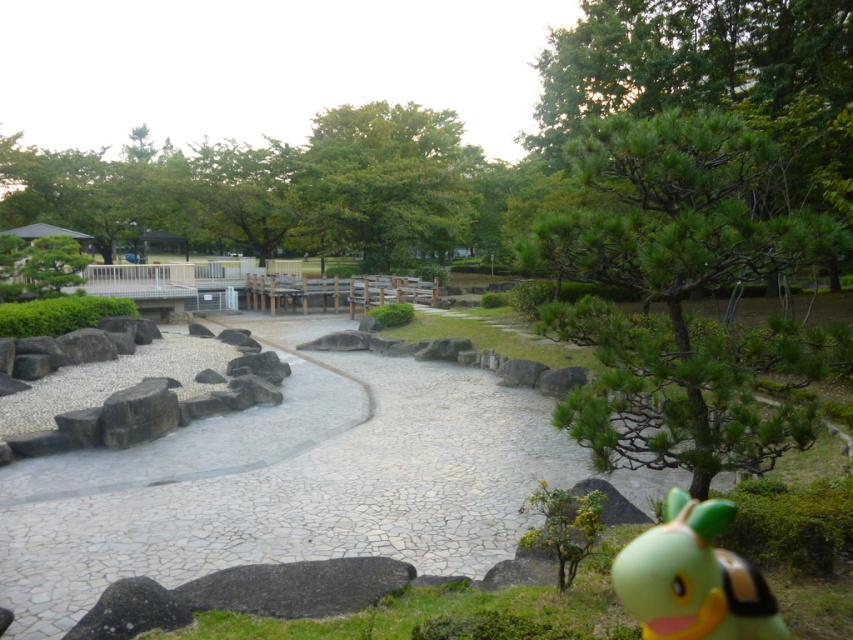
You are planning to walk along the white stone path at center and want to know if it is wide enough to pass by the green leafy tree at upper center without touching it. Can you determine this based on the scene?

The white stone path at center is smaller than the green leafy tree at upper center, so it might not be wide enough to pass by without touching the tree.

You are standing at the entrance of the park and want to reach the white stone path at center. According to the coordinates provided, where should you head to find it?

The white stone path at center is located at coordinates point [287,481], so you should head towards that coordinate to find it.

You are a gardener who wants to place a new decorative stone between the green leafy tree at center and the green rubber toy at lower right. Based on their positions, which direction should you move from the tree to reach the toy?

The green leafy tree at center is positioned on the left side of the green rubber toy at lower right, so you should move to the right from the tree to reach the toy.